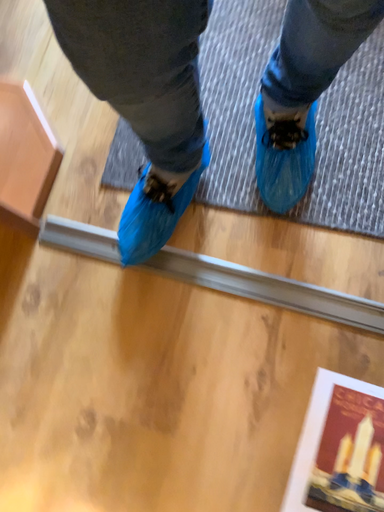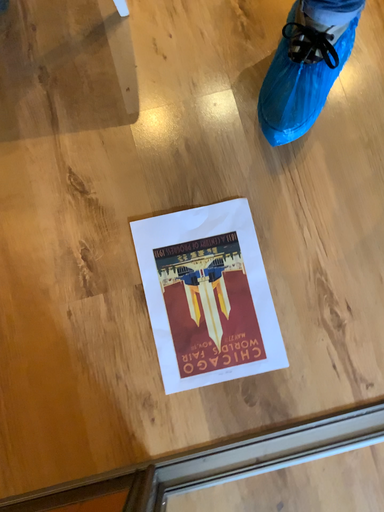
Question: Which way did the camera rotate in the video?

Choices:
 (A) rotated right
 (B) rotated left

Answer: (B)